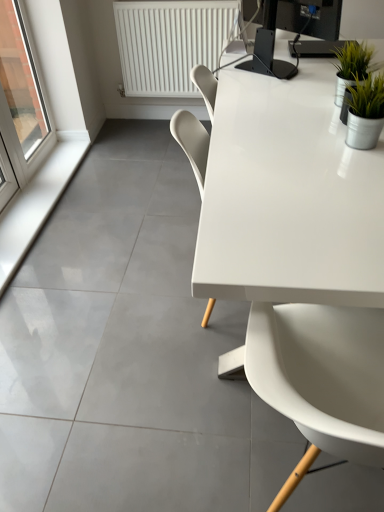
Where is `vacant space behind green metallic pot at upper right`? This screenshot has height=512, width=384. vacant space behind green metallic pot at upper right is located at coordinates (311, 83).